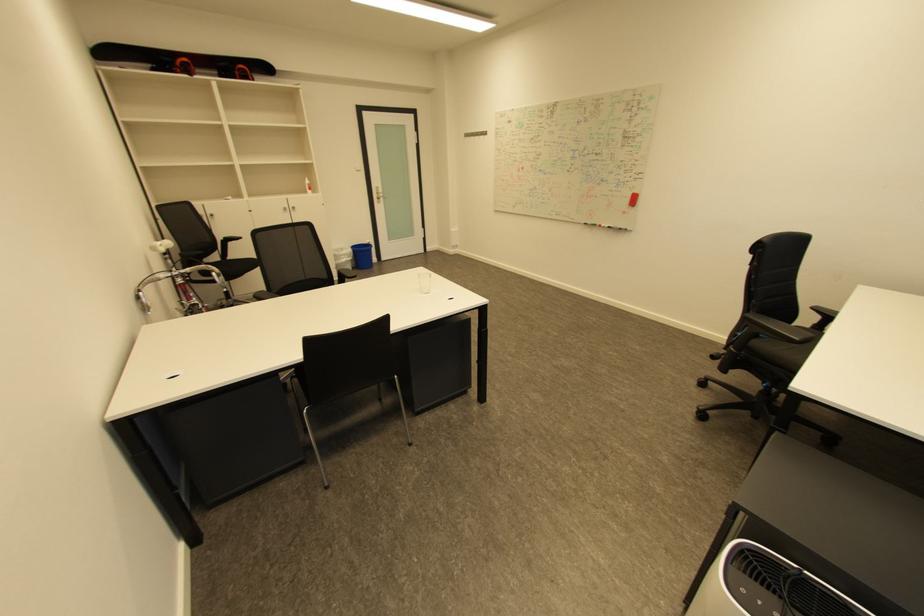
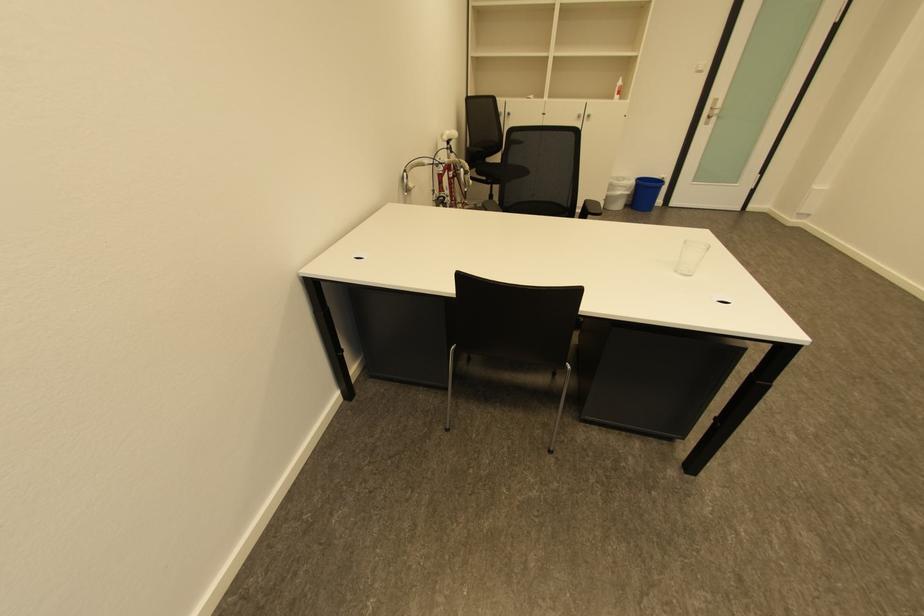
In the second image, find the point that corresponds to [349,256] in the first image.

(626, 188)